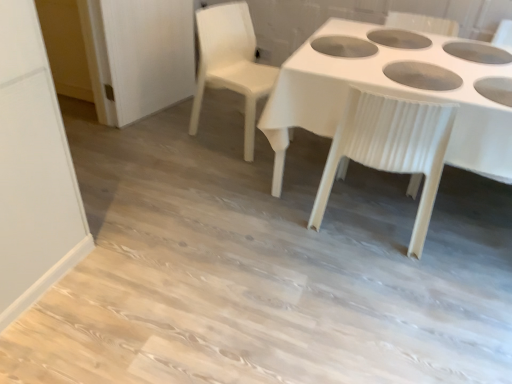
Question: Should I look upward or downward to see white plastic table at center?

Choices:
 (A) up
 (B) down

Answer: (A)

Question: Does white plastic table at center lie behind white plastic chair at center, the second chair positioned from the left?

Choices:
 (A) yes
 (B) no

Answer: (B)

Question: From a real-world perspective, is white plastic table at center positioned under white plastic chair at center, the second chair positioned from the left, based on gravity?

Choices:
 (A) yes
 (B) no

Answer: (A)

Question: Is white plastic table at center not inside white plastic chair at center, the second chair positioned from the left?

Choices:
 (A) yes
 (B) no

Answer: (A)

Question: Is white plastic table at center at the left side of white plastic chair at center, the second chair positioned from the left?

Choices:
 (A) yes
 (B) no

Answer: (B)

Question: Considering the relative sizes of white plastic table at center and white plastic chair at center, arranged as the 1th chair when viewed from the right, in the image provided, is white plastic table at center bigger than white plastic chair at center, arranged as the 1th chair when viewed from the right,?

Choices:
 (A) no
 (B) yes

Answer: (B)

Question: Can you confirm if white plastic table at center is taller than white plastic chair at center, the second chair positioned from the left?

Choices:
 (A) yes
 (B) no

Answer: (B)

Question: From a real-world perspective, is white plastic table at center physically above white plastic chair at upper center, positioned as the second chair in right-to-left order?

Choices:
 (A) yes
 (B) no

Answer: (B)

Question: From a real-world perspective, is white plastic table at center beneath white plastic chair at upper center, the first chair from the left?

Choices:
 (A) no
 (B) yes

Answer: (B)

Question: Can you confirm if white plastic table at center is shorter than white plastic chair at upper center, positioned as the second chair in right-to-left order?

Choices:
 (A) no
 (B) yes

Answer: (B)

Question: Can you confirm if white plastic table at center is thinner than white plastic chair at upper center, the first chair from the left?

Choices:
 (A) yes
 (B) no

Answer: (B)

Question: Is white plastic chair at upper center, the first chair from the left, inside white plastic table at center?

Choices:
 (A) no
 (B) yes

Answer: (A)

Question: Considering the relative sizes of white plastic table at center and white plastic chair at upper center, positioned as the second chair in right-to-left order, in the image provided, is white plastic table at center wider than white plastic chair at upper center, positioned as the second chair in right-to-left order,?

Choices:
 (A) no
 (B) yes

Answer: (B)

Question: Considering the relative sizes of white plastic chair at center, the second chair positioned from the left, and white plastic table at center in the image provided, is white plastic chair at center, the second chair positioned from the left, shorter than white plastic table at center?

Choices:
 (A) yes
 (B) no

Answer: (B)